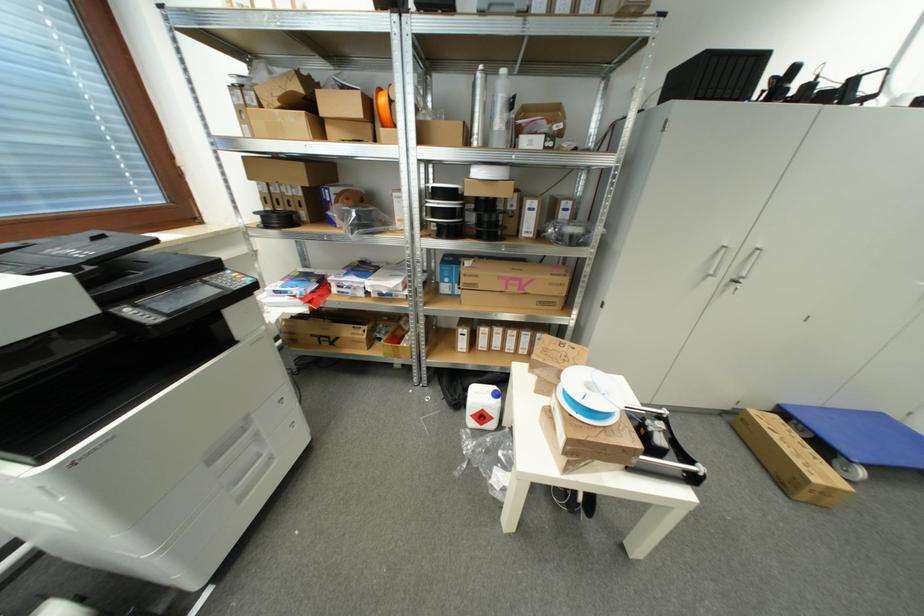
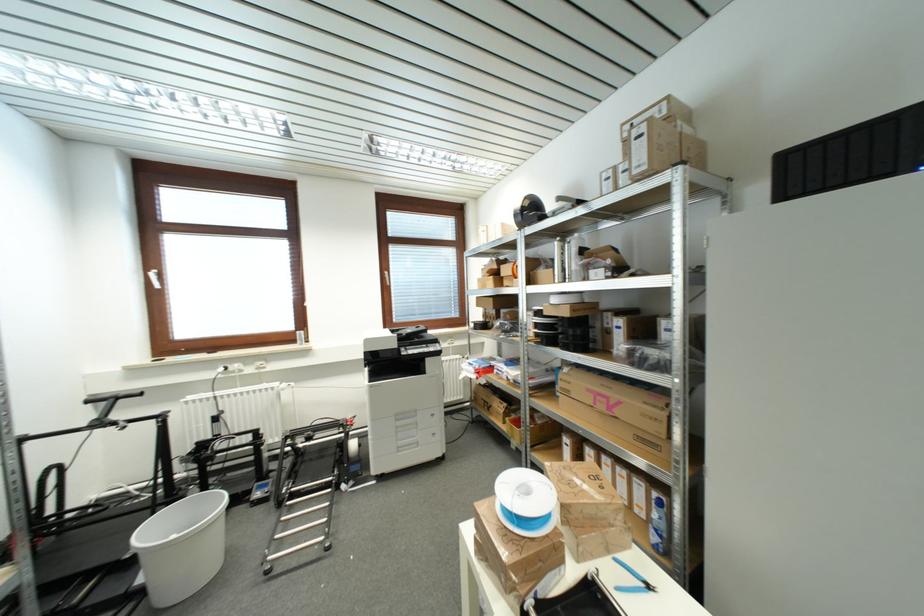
In the second image, find the point that corresponds to (x=517, y=292) in the first image.

(605, 408)